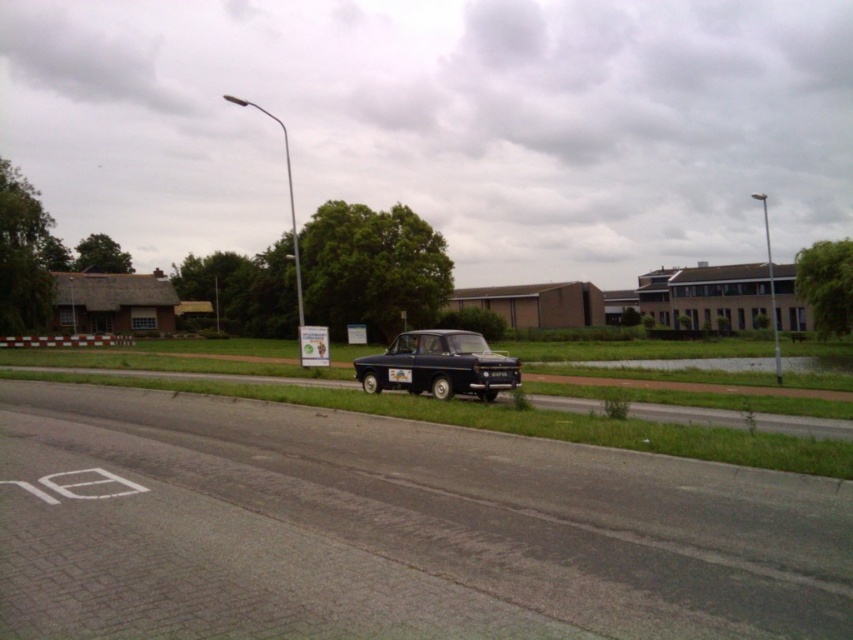
You are a pedestrian standing on the roadside and want to cross the road safely. You see a shiny blue car at center and a metallic silver car at upper center. Which car is closer to you?

The shiny blue car at center is closer to you because it is in front of the metallic silver car at upper center.

You are a delivery driver who needs to park your car between the shiny blue car at center and the metallic silver car at upper center. Given that your car is 1.8 meters wide, can you fit your car in the space between them?

The shiny blue car at center is narrower than the metallic silver car at upper center. However, the exact width of the space between them isn